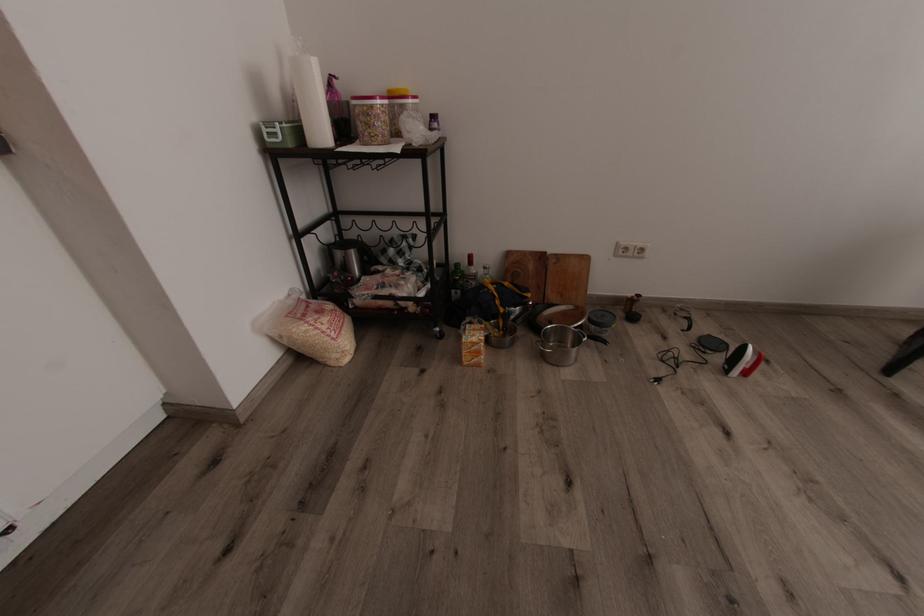
This screenshot has width=924, height=616. What are the coordinates of `silver metal kettle` in the screenshot? It's located at (682, 317).